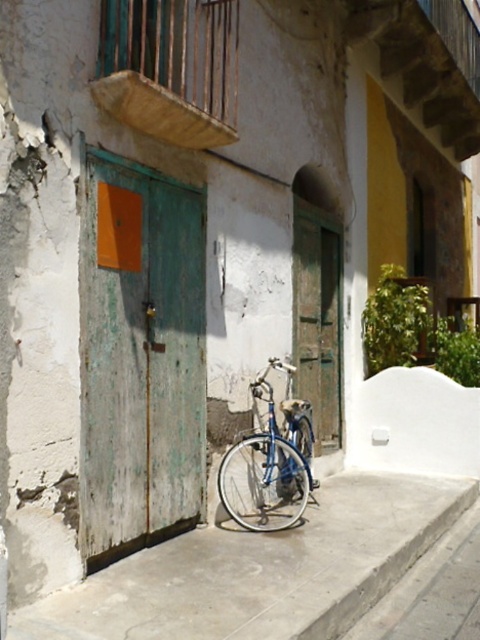
Question: Which object is closer to the camera taking this photo?

Choices:
 (A) smooth concrete pavement at center
 (B) blue metallic bicycle at center

Answer: (A)

Question: Where is green weathered wood door at left located in relation to smooth concrete pavement at center in the image?

Choices:
 (A) above
 (B) below

Answer: (A)

Question: Which point appears farthest from the camera in this image?

Choices:
 (A) (310, 381)
 (B) (252, 381)
 (C) (154, 288)
 (D) (260, 605)

Answer: (A)

Question: Which object is positioned farthest from the blue metallic bicycle at center?

Choices:
 (A) green weathered wood door at center
 (B) smooth concrete pavement at center
 (C) green weathered wood door at left

Answer: (A)

Question: Is smooth concrete pavement at center bigger than blue metallic bicycle at center?

Choices:
 (A) no
 (B) yes

Answer: (B)

Question: Can you confirm if green weathered wood door at left is bigger than blue metallic bicycle at center?

Choices:
 (A) no
 (B) yes

Answer: (B)